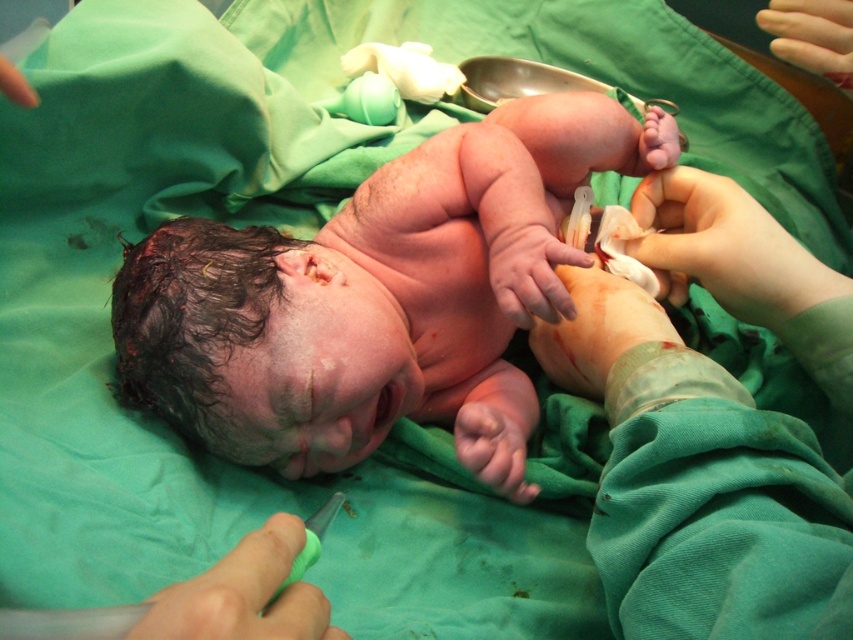
In the scene, you see a newborn baby on a green surgical drape with a person in a green surgical gown. The baby has two areas of skin visible. The pink flesh at center and the pale skin at upper right. Which area is wider?

The pink flesh at center is wider than the pale skin at upper right.

Where is the smooth skin hand at upper right located in the image?

The smooth skin hand at upper right is located at point (724, 248).